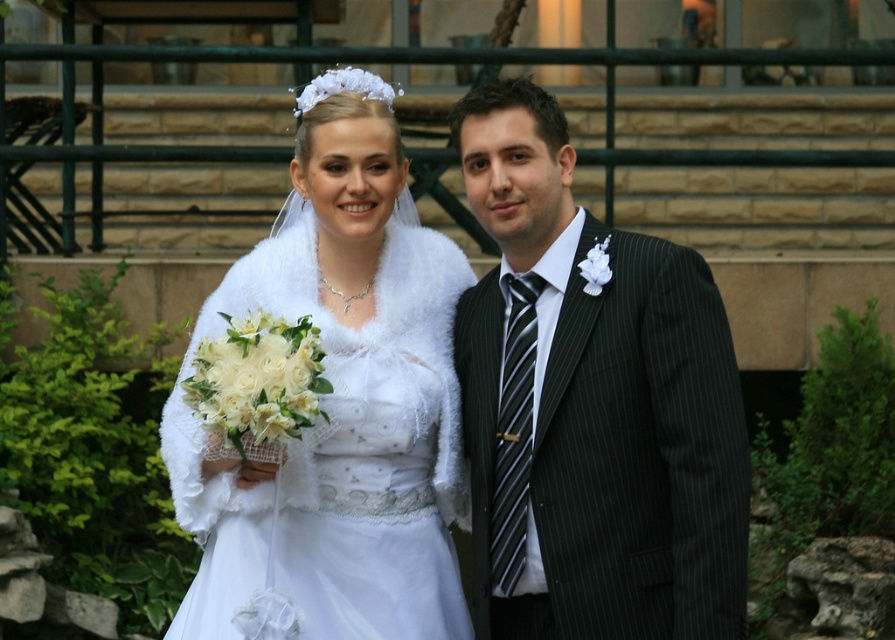
You are standing at the bottom of the stone staircase with green metal and want to walk up to the top. There are two points marked on the staircase. Which point, point (533, 266) or point (341, 600), is closer to you as you start climbing?

Point (533, 266) is closer to you as you start climbing because it is further to the viewer compared to point (341, 600).

You are a photographer at the wedding. You need to adjust the lighting so that the matte black suit at right and the white fur shawl at center are both well lit. Which object should you focus on first to ensure proper exposure?

The matte black suit at right is closer to the viewer than the white fur shawl at center, so you should focus on the matte black suit at right first to ensure proper exposure.

You are a photographer setting up for the wedding photoshoot. You need to position the matte black suit at right and the white fur shawl at center in a way that both are visible in the frame. Considering their sizes, which object should you prioritize placing closer to the camera to ensure it doesn

The matte black suit at right occupies less space than the white fur shawl at center. To ensure both are visible, prioritize placing the smaller matte black suit at right closer to the camera so its details are clear while the larger white fur shawl at center can be positioned slightly farther back but still within the frame.